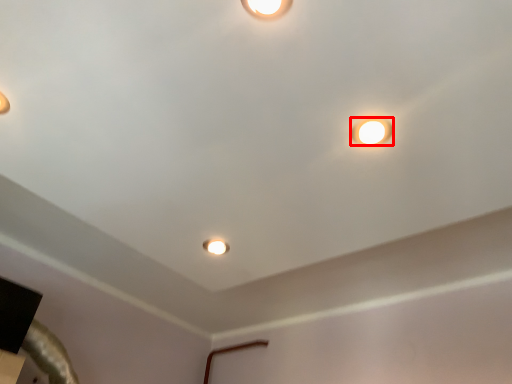
Question: In this image, where is lamp (annotated by the red box) located relative to stage light?

Choices:
 (A) left
 (B) right

Answer: (B)